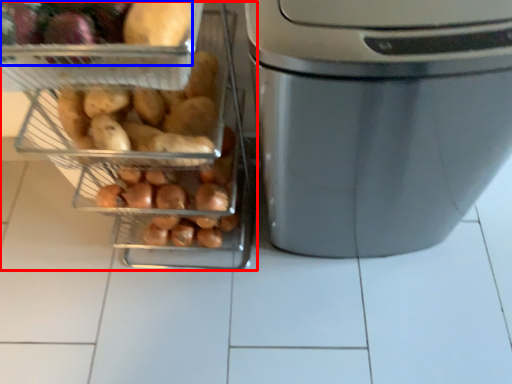
Question: Which of the following is the farthest to the observer, appliance (highlighted by a red box) or food (highlighted by a blue box)?

Choices:
 (A) appliance
 (B) food

Answer: (B)